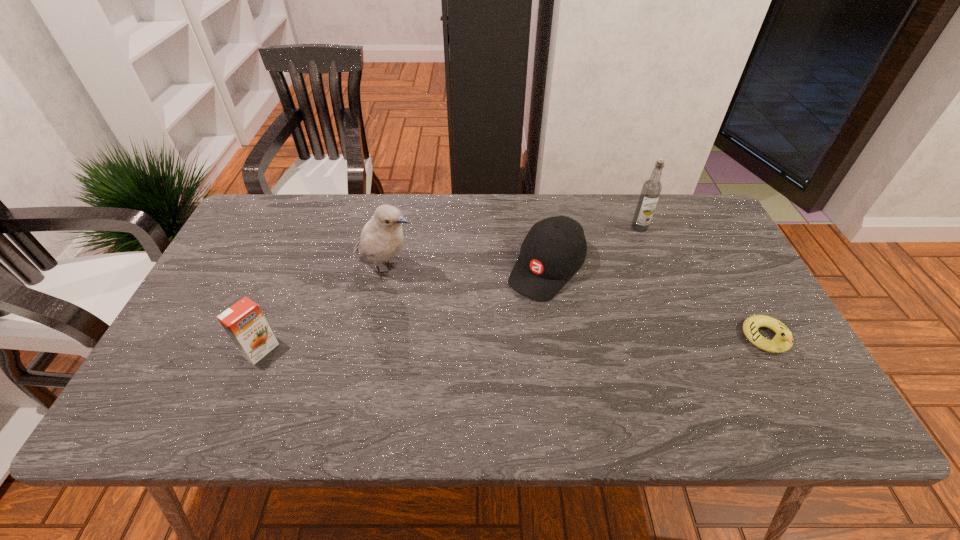
Where is `orange juice at the near edge`? Image resolution: width=960 pixels, height=540 pixels. orange juice at the near edge is located at coordinates (244, 322).

The width and height of the screenshot is (960, 540). What are the coordinates of `duckling that is at the near edge` in the screenshot? It's located at (783, 340).

Where is `object that is at the right edge`? This screenshot has width=960, height=540. object that is at the right edge is located at coordinates pyautogui.click(x=783, y=340).

Locate an element on the screen. This screenshot has height=540, width=960. object at the near right corner is located at coordinates (783, 340).

This screenshot has width=960, height=540. Find the location of `free location at the far edge`. free location at the far edge is located at coordinates (433, 212).

In the image, there is a desktop. At what (x,y) coordinates should I click in order to perform the action: click on vacant space at the near edge. Please return your answer as a coordinate pair (x, y). Image resolution: width=960 pixels, height=540 pixels. Looking at the image, I should click on (505, 362).

Where is `vacant space at the left edge`? vacant space at the left edge is located at coordinates point(215,279).

What are the coordinates of `free space at the right edge` in the screenshot? It's located at (724, 246).

What are the coordinates of `vacant space at the far left corner of the desktop` in the screenshot? It's located at pyautogui.click(x=281, y=201).

In the image, there is a desktop. Where is `vacant region at the far right corner`? vacant region at the far right corner is located at coordinates (694, 208).